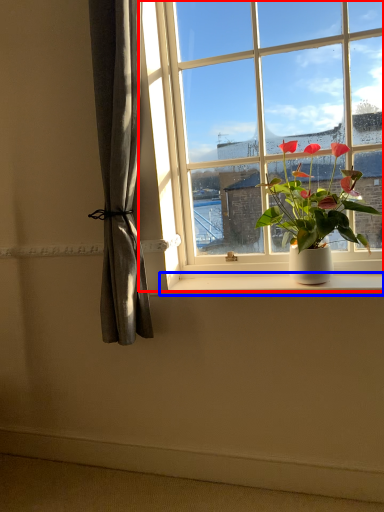
Question: Which object appears farthest to the camera in this image, window (highlighted by a red box) or window sill (highlighted by a blue box)?

Choices:
 (A) window
 (B) window sill

Answer: (B)